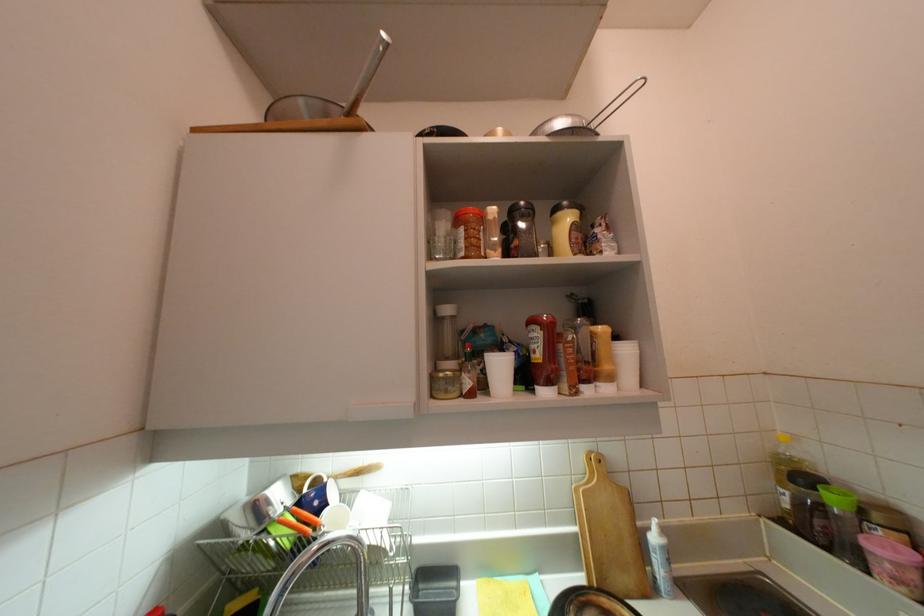
The height and width of the screenshot is (616, 924). Find the location of `strainer handle`. strainer handle is located at coordinates (616, 102).